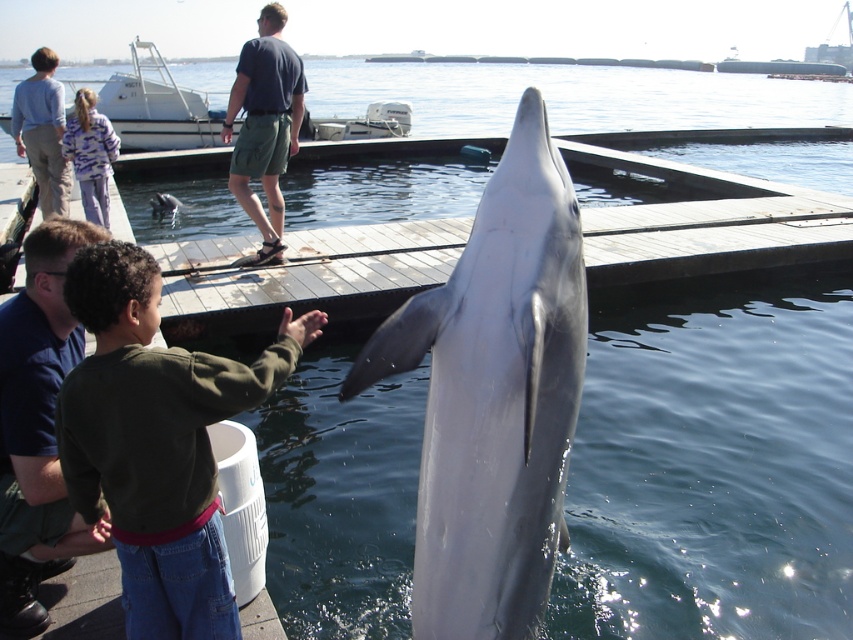
You are a photographer trying to capture a clear shot of the dolphin. You notice two people in the scene, one wearing a blue shirt at upper left and another in a dark blue cotton shirt at upper center. Which person is blocking your view less because they take up less space?

The blue shirt at upper left is blocking the view less because it occupies less space than the dark blue cotton shirt at upper center according to the description.

You are a photographer trying to capture a photo of the dolphin. You notice two people in the scene, a blue shirt at upper left and a dark blue cotton shirt at upper center. Which person is blocking your view of the dolphin if you are standing to the left of the dolphin?

The blue shirt at upper left is positioned on the right side of dark blue cotton shirt at upper center, so if you are standing to the left of the dolphin, the dark blue cotton shirt at upper center would be closer to you and blocking the view, as the blue shirt is to its right side.